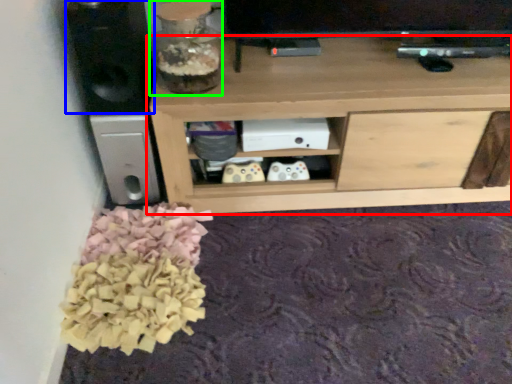
Question: Which is nearer to the shelf (highlighted by a red box)? speaker (highlighted by a blue box) or glass vase (highlighted by a green box).

Choices:
 (A) speaker
 (B) glass vase

Answer: (B)